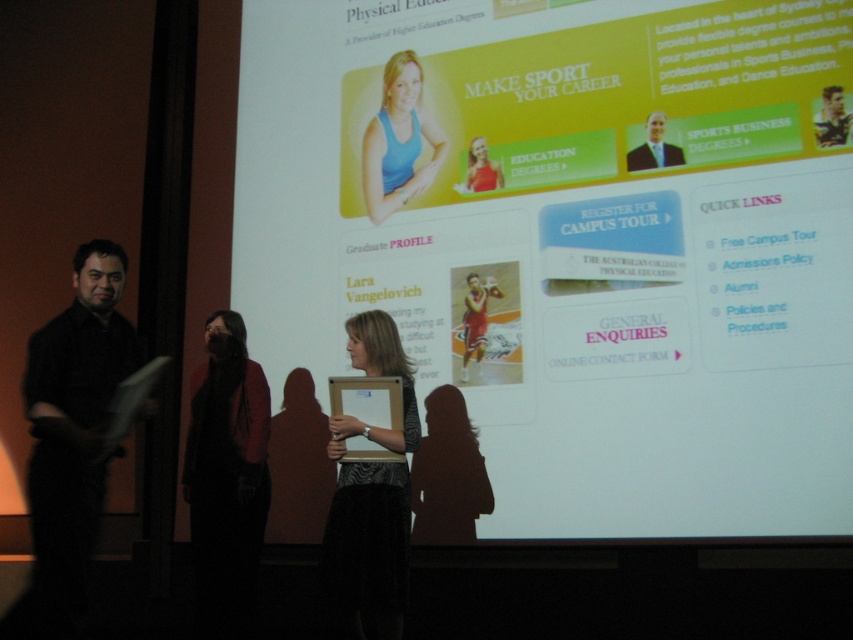
You are standing in the presentation area and want to move from the point at coordinates point (666,147) to the point at coordinates point (480,144). Can you walk directly between them without any obstacles?

Point (666,147) is in front of point (480,144), so there might be an obstacle between them. Therefore, you cannot walk directly between them without any obstacles.

You are an attendee at this presentation and want to take a photo of the white matte projection screen at upper center and the velvet black dress at center. Which object should you focus on first to ensure both are in frame?

The white matte projection screen at upper center is above the velvet black dress at center, so you should focus on the velvet black dress at center first to ensure both are in frame.